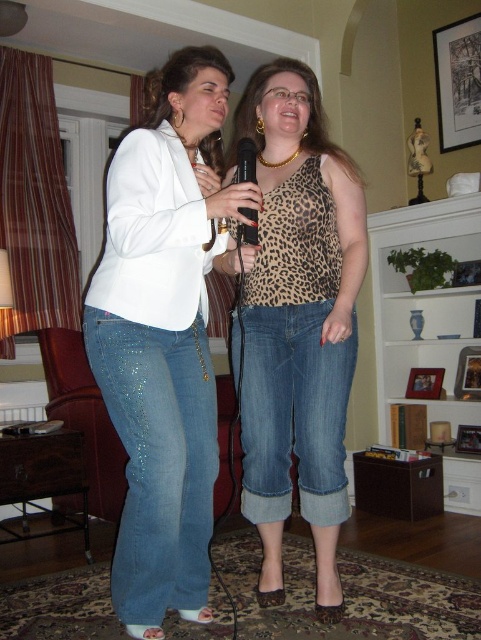
Question: Is leopard print tank top at center thinner than black plastic microphone at center?

Choices:
 (A) no
 (B) yes

Answer: (A)

Question: Which of the following is the closest to the observer?

Choices:
 (A) (210, 61)
 (B) (233, 152)

Answer: (A)

Question: Which object is the closest to the leopard print tank top at center?

Choices:
 (A) matte white blazer at center
 (B) black plastic microphone at center

Answer: (A)

Question: Which point is closer to the camera?

Choices:
 (A) (331, 344)
 (B) (243, 211)
 (C) (154, 452)

Answer: (C)

Question: Is matte white blazer at center bigger than leopard print tank top at center?

Choices:
 (A) no
 (B) yes

Answer: (B)

Question: Is matte white blazer at center further to the viewer compared to leopard print tank top at center?

Choices:
 (A) yes
 (B) no

Answer: (B)